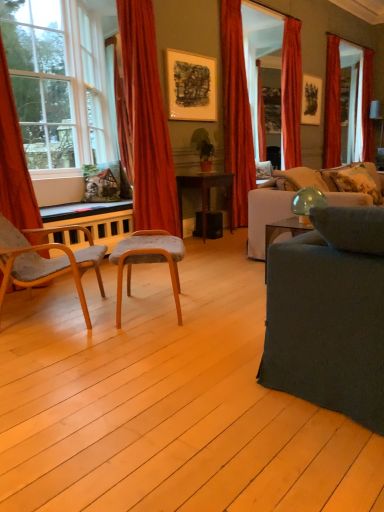
Describe the element at coordinates (357, 181) in the screenshot. I see `fluffy beige pillow at right, which is counted as the 2th pillow, starting from the left` at that location.

Measure the distance between fluffy beige pillow at right, the first pillow from the right, and camera.

fluffy beige pillow at right, the first pillow from the right, is 3.08 meters from camera.

What is the approximate height of velvet gray couch at right, which is counted as the 2th studio couch, starting from the front?

It is 83.28 centimeters.

What do you see at coordinates (266, 212) in the screenshot?
I see `velvet gray couch at right, which is counted as the 2th studio couch, starting from the front` at bounding box center [266, 212].

Measure the distance between velvet red curtain at center, which is counted as the 4th curtain, starting from the back, and camera.

velvet red curtain at center, which is counted as the 4th curtain, starting from the back, is 3.90 meters from camera.

How much space does velvet red curtain at center, which is counted as the 4th curtain, starting from the back, occupy horizontally?

velvet red curtain at center, which is counted as the 4th curtain, starting from the back, is 13.65 inches in width.

Describe the element at coordinates (332, 105) in the screenshot. I see `red velvet curtain at upper right, the first curtain viewed from the right` at that location.

What do you see at coordinates (329, 314) in the screenshot? I see `dark gray fabric couch at right, which ranks as the second studio couch in back-to-front order` at bounding box center [329, 314].

How much space does dark gray fabric couch at right, which ranks as the second studio couch in back-to-front order, occupy horizontally?

dark gray fabric couch at right, which ranks as the second studio couch in back-to-front order, is 38.49 inches in width.

The image size is (384, 512). I want to click on beige fabric pillow at right, acting as the 2th pillow starting from the right, so [x=302, y=178].

This screenshot has height=512, width=384. What are the coordinates of `gray fabric stool at center, which appears as the 1th chair when viewed from the right` in the screenshot? It's located at (148, 260).

Between matte black picture frame at upper center, placed as the second picture frame when sorted from right to left, and translucent glass lampshade at upper right, which one is positioned behind?

translucent glass lampshade at upper right is further away from the camera.

Does matte black picture frame at upper center, which is counted as the 1th picture frame, starting from the left, have a larger size compared to translucent glass lampshade at upper right?

Incorrect, matte black picture frame at upper center, which is counted as the 1th picture frame, starting from the left, is not larger than translucent glass lampshade at upper right.

Considering the relative positions of matte black picture frame at upper center, the 1th picture frame viewed from the front, and translucent glass lampshade at upper right in the image provided, is matte black picture frame at upper center, the 1th picture frame viewed from the front, to the right of translucent glass lampshade at upper right from the viewer's perspective?

No.

Consider the image. Is matte black picture frame at upper center, placed as the second picture frame when sorted from right to left, looking in the opposite direction of translucent glass lampshade at upper right?

No, matte black picture frame at upper center, placed as the second picture frame when sorted from right to left, is not facing away from translucent glass lampshade at upper right.

Is green matte houseplant at center not inside orange velvet curtain at left, which appears as the first curtain when viewed from the left?

green matte houseplant at center is positioned outside orange velvet curtain at left, which appears as the first curtain when viewed from the left.

In the scene shown: Is green matte houseplant at center aimed at orange velvet curtain at left, the first curtain in the front-to-back sequence?

No, green matte houseplant at center is not oriented towards orange velvet curtain at left, the first curtain in the front-to-back sequence.

From the image's perspective, which is below, green matte houseplant at center or orange velvet curtain at left, the 5th curtain from the right?

From the image's view, orange velvet curtain at left, the 5th curtain from the right, is below.

Where is `the 2nd curtain to the left of the green matte houseplant at center, counting from the anchor's position`? The width and height of the screenshot is (384, 512). the 2nd curtain to the left of the green matte houseplant at center, counting from the anchor's position is located at coordinates (14, 161).

Looking at this image, would you say green matte houseplant at center is a long distance from velvet red curtain at center, which is the fourth curtain in right-to-left order?

No, green matte houseplant at center is not far from velvet red curtain at center, which is the fourth curtain in right-to-left order.

Does green matte houseplant at center have a lesser width compared to velvet red curtain at center, which is counted as the 4th curtain, starting from the back?

Indeed, green matte houseplant at center has a lesser width compared to velvet red curtain at center, which is counted as the 4th curtain, starting from the back.

Consider the image. Which object is positioned more to the right, green matte houseplant at center or velvet red curtain at center, which appears as the 2th curtain when viewed from the front?

Positioned to the right is green matte houseplant at center.

In the scene shown: Does green matte houseplant at center have a greater height compared to velvet red curtain at center, which is counted as the 4th curtain, starting from the back?

No.

Is wooden desk at center located outside matte black picture frame at upper right, marked as the 2th picture frame in a left-to-right arrangement?

Yes, wooden desk at center is located beyond the bounds of matte black picture frame at upper right, marked as the 2th picture frame in a left-to-right arrangement.

Which of these two, wooden desk at center or matte black picture frame at upper right, the second picture frame positioned from the bottom, is bigger?

Bigger between the two is wooden desk at center.

From the image's perspective, is wooden desk at center on matte black picture frame at upper right, the 1th picture frame positioned from the top?

No.

Considering the sizes of red velvet curtain at upper right, marked as the first curtain in a back-to-front arrangement, and translucent glass lampshade at upper right in the image, is red velvet curtain at upper right, marked as the first curtain in a back-to-front arrangement, taller or shorter than translucent glass lampshade at upper right?

Considering their sizes, red velvet curtain at upper right, marked as the first curtain in a back-to-front arrangement, has more height than translucent glass lampshade at upper right.

Is red velvet curtain at upper right, the first curtain viewed from the right, facing towards translucent glass lampshade at upper right?

No, red velvet curtain at upper right, the first curtain viewed from the right, is not turned towards translucent glass lampshade at upper right.

From the image's perspective, is red velvet curtain at upper right, the first curtain viewed from the right, above translucent glass lampshade at upper right?

Yes.

Is point (334, 114) behind point (383, 126)?

That is False.

Could velvet orange curtain at upper right, arranged as the fourth curtain when viewed from the left, be considered to be inside wooden desk at center?

Actually, velvet orange curtain at upper right, arranged as the fourth curtain when viewed from the left, is outside wooden desk at center.

Which is more to the left, wooden desk at center or velvet orange curtain at upper right, which appears as the 4th curtain when viewed from the front?

wooden desk at center is more to the left.

Considering the relative sizes of wooden desk at center and velvet orange curtain at upper right, which appears as the 4th curtain when viewed from the front, in the image provided, is wooden desk at center shorter than velvet orange curtain at upper right, which appears as the 4th curtain when viewed from the front,?

Yes.

This screenshot has width=384, height=512. I want to click on desk that appears on the left of velvet orange curtain at upper right, marked as the second curtain in a back-to-front arrangement, so click(206, 195).

Is green matte houseplant at center completely or partially outside of red velvet curtain at upper right, the first curtain viewed from the right?

green matte houseplant at center lies outside red velvet curtain at upper right, the first curtain viewed from the right,'s area.

Between green matte houseplant at center and red velvet curtain at upper right, marked as the first curtain in a back-to-front arrangement, which one is positioned behind?

red velvet curtain at upper right, marked as the first curtain in a back-to-front arrangement, is behind.

Is green matte houseplant at center positioned with its back to red velvet curtain at upper right, the first curtain viewed from the right?

No, green matte houseplant at center's orientation is not away from red velvet curtain at upper right, the first curtain viewed from the right.

Considering the relative sizes of green matte houseplant at center and red velvet curtain at upper right, which is the 5th curtain in left-to-right order, in the image provided, is green matte houseplant at center bigger than red velvet curtain at upper right, which is the 5th curtain in left-to-right order,?

No, green matte houseplant at center is not bigger than red velvet curtain at upper right, which is the 5th curtain in left-to-right order.

Image resolution: width=384 pixels, height=512 pixels. Find the location of `picture frame below the translucent glass lampshade at upper right (from the image's perspective)`. picture frame below the translucent glass lampshade at upper right (from the image's perspective) is located at coordinates tap(191, 86).

This screenshot has width=384, height=512. In the image, there is a orange velvet curtain at left, which appears as the first curtain when viewed from the left. Identify the location of houseplant above it (from the image's perspective). [203, 148].

Estimate the real-world distances between objects in this image. Which object is further from gray fabric stool at center, the 2th chair positioned from the left, velvet red curtain at center, which is counted as the 4th curtain, starting from the back, or velvet gray couch at right, which appears as the first studio couch when viewed from the back?

Among the two, velvet red curtain at center, which is counted as the 4th curtain, starting from the back, is located further to gray fabric stool at center, the 2th chair positioned from the left.

From the image, which object appears to be nearer to fluffy beige pillow at right, the first pillow from the right, green matte houseplant at center or matte black picture frame at upper right, the second picture frame positioned from the bottom?

The object closer to fluffy beige pillow at right, the first pillow from the right, is green matte houseplant at center.

Considering their positions, is wooden chair at left, marked as the 1th chair in a left-to-right arrangement, positioned closer to velvet gray couch at right, which is counted as the 2th studio couch, starting from the front, than matte black picture frame at upper right, arranged as the first picture frame when viewed from the back?

Based on the image, wooden chair at left, marked as the 1th chair in a left-to-right arrangement, appears to be nearer to velvet gray couch at right, which is counted as the 2th studio couch, starting from the front.

From the image, which object appears to be nearer to gray fabric stool at center, which appears as the 1th chair when viewed from the right, green matte houseplant at center or matte black picture frame at upper center, marked as the 1th picture frame in a bottom-to-top arrangement?

green matte houseplant at center lies closer to gray fabric stool at center, which appears as the 1th chair when viewed from the right, than the other object.

When comparing their distances from clear glass window at left, does translucent glass lampshade at upper right or velvet gray couch at right, which appears as the first studio couch when viewed from the back, seem closer?

velvet gray couch at right, which appears as the first studio couch when viewed from the back, is closer to clear glass window at left.

Which object lies further to the anchor point gray fabric stool at center, the 2th chair positioned from the left, red velvet curtain at upper right, which is the 5th curtain in left-to-right order, or velvet red curtain at center, which is the third curtain from right to left?

The object further to gray fabric stool at center, the 2th chair positioned from the left, is red velvet curtain at upper right, which is the 5th curtain in left-to-right order.

Based on their spatial positions, is wooden desk at center or matte black picture frame at upper right, the second picture frame positioned from the bottom, further from green matte houseplant at center?

matte black picture frame at upper right, the second picture frame positioned from the bottom, lies further to green matte houseplant at center than the other object.

Considering their positions, is fluffy beige pillow at right, the first pillow from the right, positioned closer to beige fabric pillow at right, the first pillow when ordered from left to right, than matte black picture frame at upper right, which ranks as the first picture frame in right-to-left order?

Based on the image, fluffy beige pillow at right, the first pillow from the right, appears to be nearer to beige fabric pillow at right, the first pillow when ordered from left to right.

This screenshot has width=384, height=512. What are the coordinates of `houseplant positioned between dark gray fabric couch at right, the 1th studio couch when ordered from front to back, and velvet orange curtain at upper right, which appears as the 4th curtain when viewed from the front, from near to far` in the screenshot? It's located at (203, 148).

Image resolution: width=384 pixels, height=512 pixels. I want to click on desk between velvet red curtain at center, which is the fourth curtain in right-to-left order, and translucent glass lampshade at upper right from front to back, so click(206, 195).

The image size is (384, 512). I want to click on picture frame between dark gray fabric couch at right, which ranks as the second studio couch in back-to-front order, and velvet orange curtain at upper right, arranged as the fourth curtain when viewed from the left, in the front-back direction, so click(x=191, y=86).

In order to click on houseplant between clear glass window at left and translucent glass lampshade at upper right in this screenshot , I will do `click(203, 148)`.